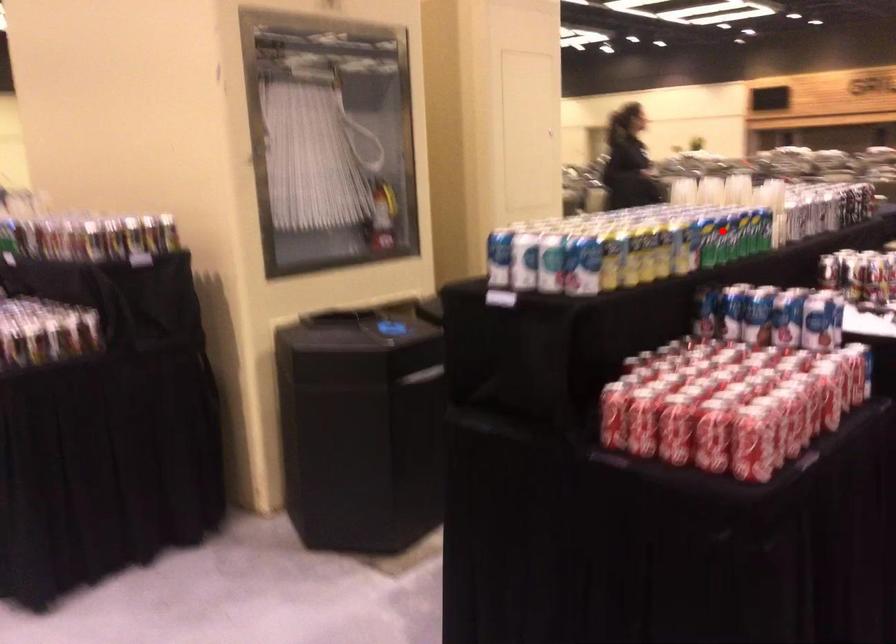
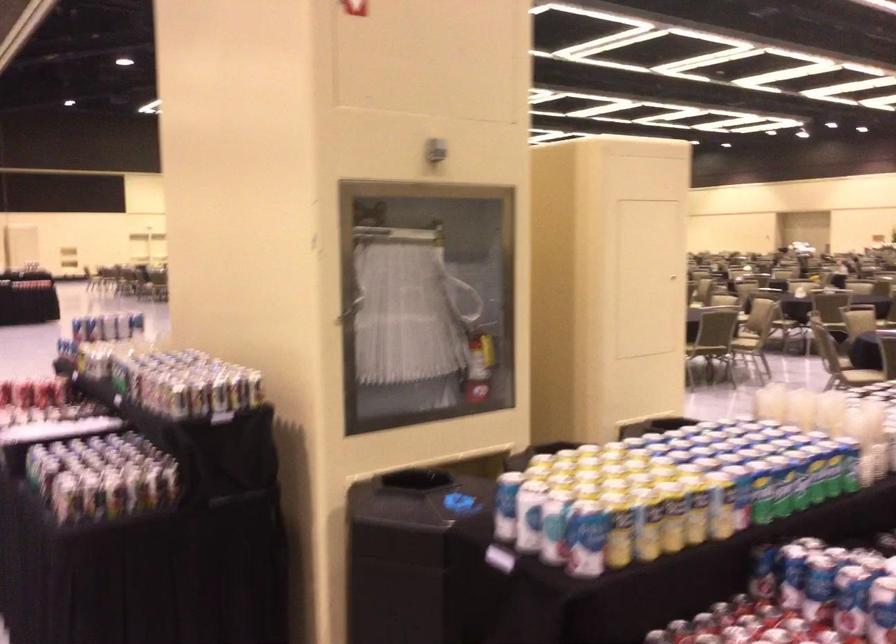
Question: A red point is marked in image1. In image2, is the corresponding 3D point closer to the camera or farther? Reply with the corresponding letter.

Choices:
 (A) The corresponding 3D point is closer.
 (B) The corresponding 3D point is farther.

Answer: (A)